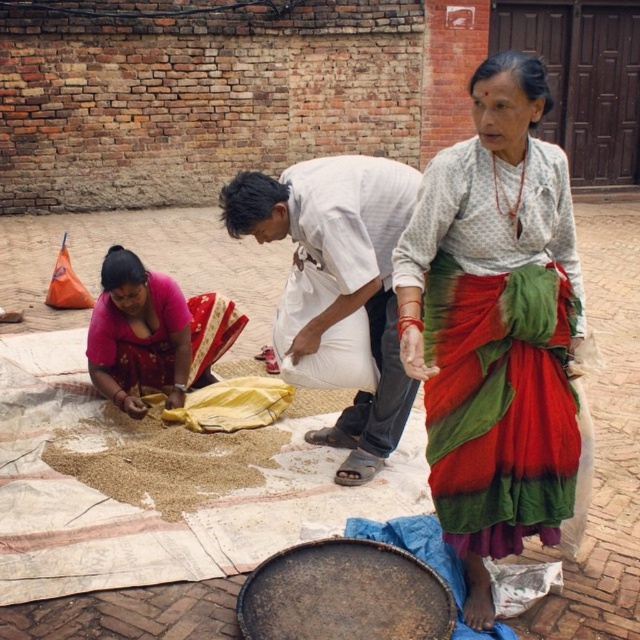
You are standing in the scene and want to place a small object between the multicolored fabric at center and the matte pink blouse at lower left. Based on their positions, which object should be closer to the left side?

The matte pink blouse at lower left is to the left of the multicolored fabric at center, so placing the small object between them would mean the matte pink blouse at lower left is closer to the left side.

You are trying to decide where to place a small decorative item. The multicolored fabric at center and the matte pink blouse at lower left are both options. Which surface has a narrower width?

The multicolored fabric at center has a lesser width compared to the matte pink blouse at lower left, so it is narrower.